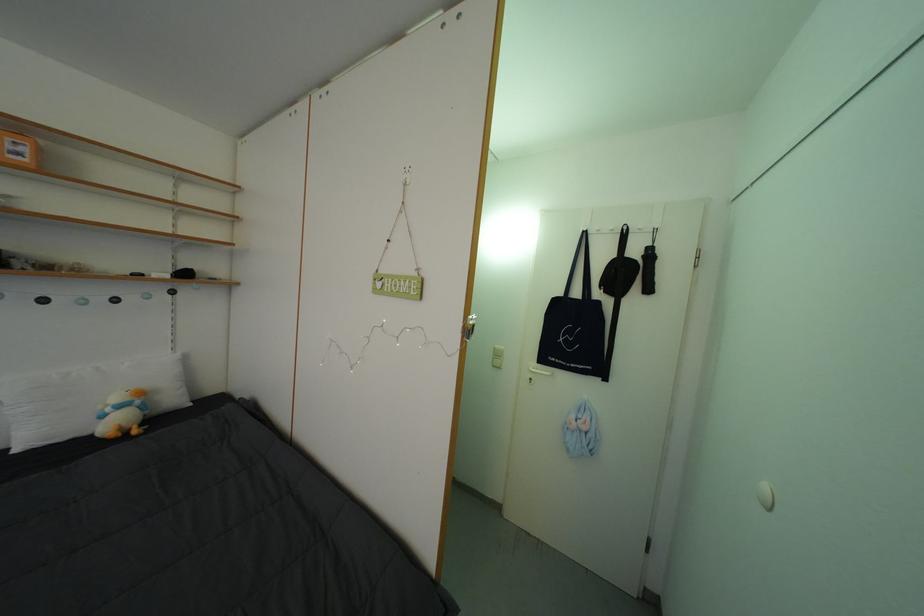
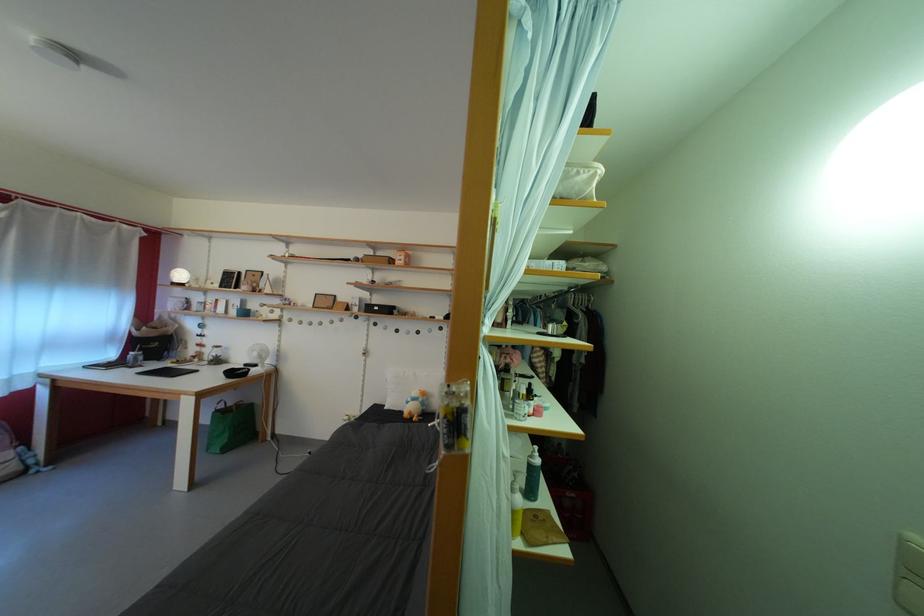
Locate, in the second image, the point that corresponds to (x=504, y=354) in the first image.

(913, 545)